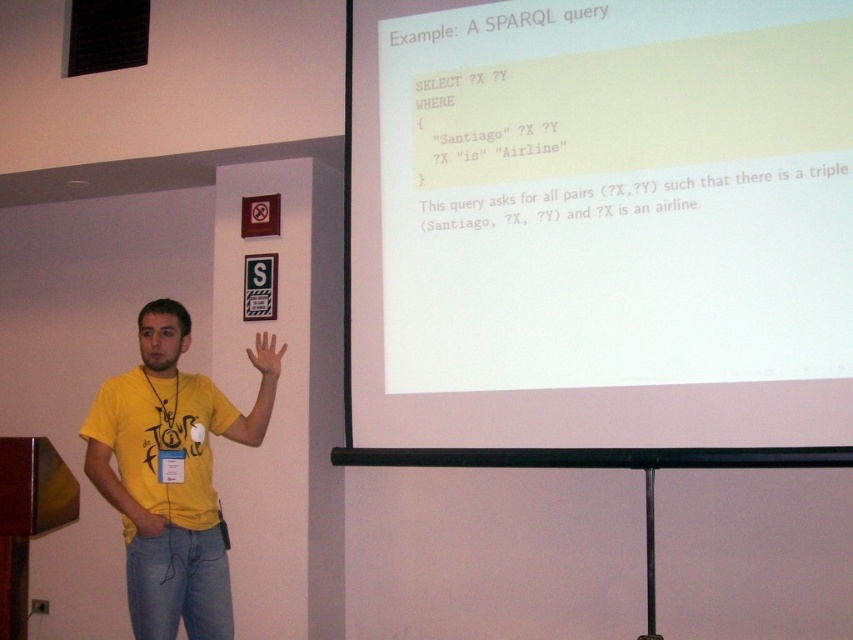
Question: Which of the following is the closest to the observer?

Choices:
 (A) (144, 531)
 (B) (283, 348)
 (C) (636, 349)

Answer: (A)

Question: Which object appears closest to the camera in this image?

Choices:
 (A) matte yellow hand at center
 (B) yellow matte hand at lower left
 (C) yellow t-shirt at center

Answer: (B)

Question: Which object is the closest to the yellow t-shirt at center?

Choices:
 (A) white paper at upper center
 (B) matte yellow hand at center

Answer: (B)

Question: Is white paper at upper center closer to camera compared to yellow t-shirt at center?

Choices:
 (A) yes
 (B) no

Answer: (A)

Question: Is yellow t-shirt at center above matte yellow hand at center?

Choices:
 (A) no
 (B) yes

Answer: (A)

Question: Does white paper at upper center have a greater width compared to yellow t-shirt at center?

Choices:
 (A) yes
 (B) no

Answer: (A)